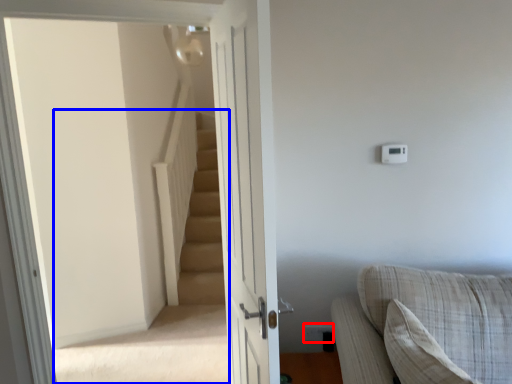
Question: Among these objects, which one is nearest to the camera, electric outlet (highlighted by a red box) or stairwell (highlighted by a blue box)?

Choices:
 (A) electric outlet
 (B) stairwell

Answer: (B)